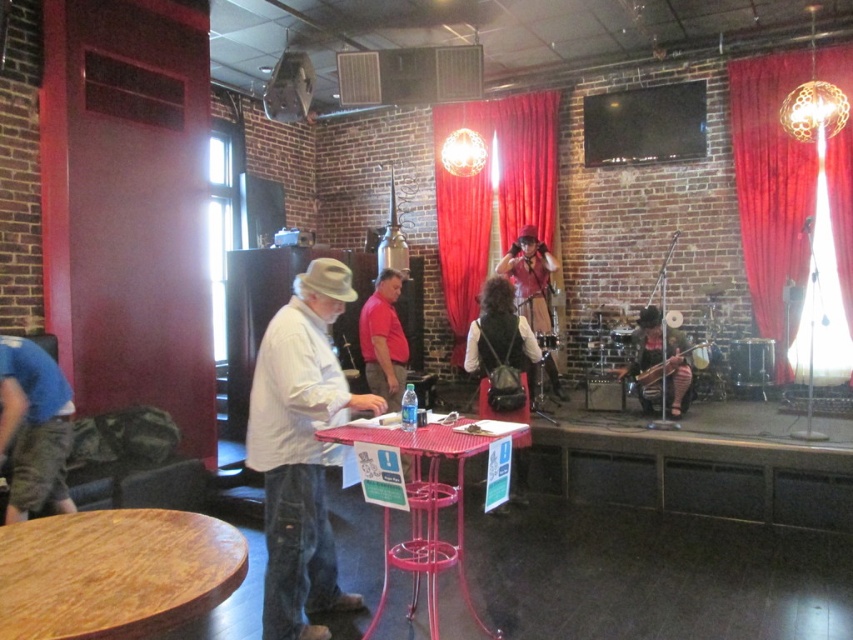
You are a photographer standing at the entrance of the music club. You want to place a camera on a surface that is closest to the stage. Which object should you choose between the wooden table at lower left and the stage?

The wooden table at lower left is located at point (114, 572), so it is closer to the stage than the stage itself. Therefore, you should place the camera on the wooden table at lower left.